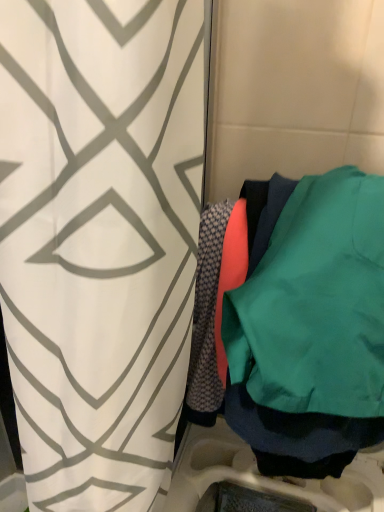
This screenshot has width=384, height=512. I want to click on white geometric-patterned curtain at center, so click(99, 240).

The image size is (384, 512). What do you see at coordinates (99, 240) in the screenshot?
I see `white geometric-patterned curtain at center` at bounding box center [99, 240].

In order to face white geometric-patterned curtain at center, should I rotate leftwards or rightwards?

You should rotate left by 10.679 degrees.

In order to face teal matte sweatshirt at right, should I rotate leftwards or rightwards?

A 16.730 degree turn to the right will do.

Image resolution: width=384 pixels, height=512 pixels. What do you see at coordinates (315, 303) in the screenshot? I see `teal matte sweatshirt at right` at bounding box center [315, 303].

The height and width of the screenshot is (512, 384). Identify the location of teal matte sweatshirt at right. (315, 303).

Where is `white geometric-patterned curtain at center`? The width and height of the screenshot is (384, 512). white geometric-patterned curtain at center is located at coordinates (99, 240).

Does white geometric-patterned curtain at center appear on the left side of teal matte sweatshirt at right?

Indeed, white geometric-patterned curtain at center is positioned on the left side of teal matte sweatshirt at right.

Is the depth of white geometric-patterned curtain at center greater than that of teal matte sweatshirt at right?

No, the depth of white geometric-patterned curtain at center is less than that of teal matte sweatshirt at right.

Does point (43, 119) come in front of point (261, 358)?

Yes, it is in front of point (261, 358).

From the image's perspective, between white geometric-patterned curtain at center and teal matte sweatshirt at right, who is located below?

white geometric-patterned curtain at center, from the image's perspective.

From a real-world perspective, is white geometric-patterned curtain at center positioned above or below teal matte sweatshirt at right?

white geometric-patterned curtain at center is situated lower than teal matte sweatshirt at right in the real world.

Does white geometric-patterned curtain at center have a lesser width compared to teal matte sweatshirt at right?

Incorrect, the width of white geometric-patterned curtain at center is not less than that of teal matte sweatshirt at right.

From their relative heights in the image, would you say white geometric-patterned curtain at center is taller or shorter than teal matte sweatshirt at right?

Considering their sizes, white geometric-patterned curtain at center has more height than teal matte sweatshirt at right.

Is white geometric-patterned curtain at center smaller than teal matte sweatshirt at right?

Incorrect, white geometric-patterned curtain at center is not smaller in size than teal matte sweatshirt at right.

From the picture: Could teal matte sweatshirt at right be considered to be inside white geometric-patterned curtain at center?

Actually, teal matte sweatshirt at right is outside white geometric-patterned curtain at center.

Are white geometric-patterned curtain at center and teal matte sweatshirt at right located far from each other?

No, white geometric-patterned curtain at center is not far from teal matte sweatshirt at right.

Could you tell me if white geometric-patterned curtain at center is facing teal matte sweatshirt at right?

Yes, white geometric-patterned curtain at center is aimed at teal matte sweatshirt at right.

How different are the orientations of white geometric-patterned curtain at center and teal matte sweatshirt at right in degrees?

The facing directions of white geometric-patterned curtain at center and teal matte sweatshirt at right are 79.7 degrees apart.

How much distance is there between white geometric-patterned curtain at center and teal matte sweatshirt at right?

7.86 inches.

This screenshot has height=512, width=384. In the image, there is a teal matte sweatshirt at right. In order to click on curtain below it (from the image's perspective) in this screenshot , I will do `click(99, 240)`.

Does teal matte sweatshirt at right appear on the right side of white geometric-patterned curtain at center?

Indeed, teal matte sweatshirt at right is positioned on the right side of white geometric-patterned curtain at center.

Which object is further away from the camera, teal matte sweatshirt at right or white geometric-patterned curtain at center?

teal matte sweatshirt at right is behind.

Between point (322, 177) and point (70, 507), which one is positioned in front?

The point (70, 507) is closer.

From the image's perspective, which object appears higher, teal matte sweatshirt at right or white geometric-patterned curtain at center?

teal matte sweatshirt at right is shown above in the image.

From a real-world perspective, is teal matte sweatshirt at right beneath white geometric-patterned curtain at center?

No.

Which of these two, teal matte sweatshirt at right or white geometric-patterned curtain at center, is thinner?

teal matte sweatshirt at right.

Is teal matte sweatshirt at right taller than white geometric-patterned curtain at center?

No, teal matte sweatshirt at right is not taller than white geometric-patterned curtain at center.

Based on their sizes in the image, would you say teal matte sweatshirt at right is bigger or smaller than white geometric-patterned curtain at center?

teal matte sweatshirt at right is smaller than white geometric-patterned curtain at center.

Can white geometric-patterned curtain at center be found inside teal matte sweatshirt at right?

Definitely not — white geometric-patterned curtain at center is not inside teal matte sweatshirt at right.

Is teal matte sweatshirt at right far away from white geometric-patterned curtain at center?

They are positioned close to each other.

Could you tell me if teal matte sweatshirt at right is turned towards white geometric-patterned curtain at center?

Answer: No, teal matte sweatshirt at right does not turn towards white geometric-patterned curtain at center.

In the image, there is a white geometric-patterned curtain at center. At what (x,y) coordinates should I click in order to perform the action: click on sweatshirt above it (from the image's perspective). Please return your answer as a coordinate pair (x, y). The height and width of the screenshot is (512, 384). Looking at the image, I should click on (315, 303).

You are a GUI agent. You are given a task and a screenshot of the screen. Output one action in this format:
    pyautogui.click(x=<x>, y=<y>)
    Task: Click on the curtain below the teal matte sweatshirt at right (from the image's perspective)
    
    Given the screenshot: What is the action you would take?
    pyautogui.click(x=99, y=240)

At what (x,y) coordinates should I click in order to perform the action: click on curtain below the teal matte sweatshirt at right (from a real-world perspective). Please return your answer as a coordinate pair (x, y). This screenshot has height=512, width=384. Looking at the image, I should click on click(99, 240).